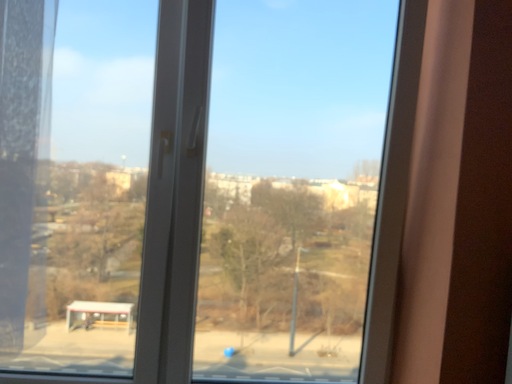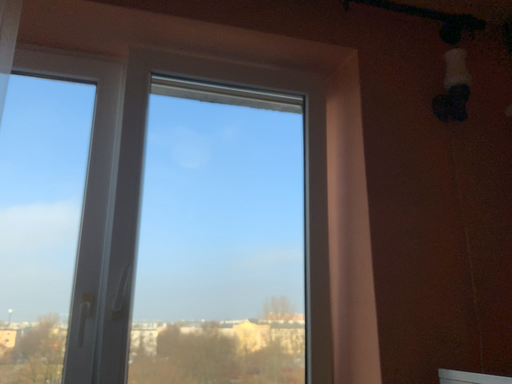
Question: Which way did the camera rotate in the video?

Choices:
 (A) rotated right
 (B) rotated left

Answer: (A)